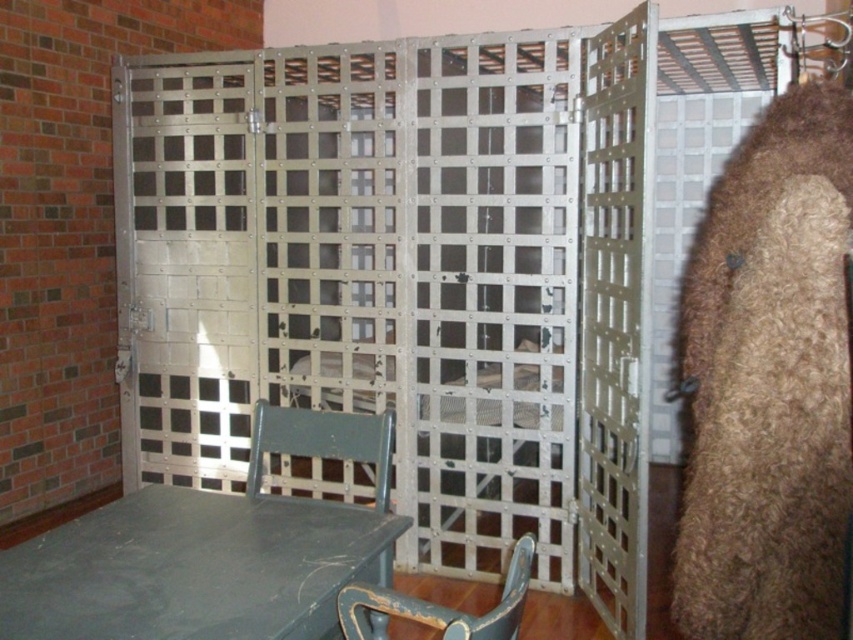
Is metallic grid cage at center closer to the viewer compared to matte green chair at center?

No.

Which of these two, metallic grid cage at center or matte green chair at center, stands taller?

Standing taller between the two is metallic grid cage at center.

This screenshot has height=640, width=853. Identify the location of metallic grid cage at center. (405, 280).

Image resolution: width=853 pixels, height=640 pixels. What are the coordinates of `metallic grid cage at center` in the screenshot? It's located at (405, 280).

Is brown fuzzy coat at right to the left of matte green chair at center from the viewer's perspective?

In fact, brown fuzzy coat at right is to the right of matte green chair at center.

Who is more distant from viewer, (747, 326) or (384, 579)?

The point (747, 326) is behind.

Who is more forward, (820, 339) or (386, 572)?

Point (820, 339)

At what (x,y) coordinates should I click in order to perform the action: click on brown fuzzy coat at right. Please return your answer as a coordinate pair (x, y). The image size is (853, 640). Looking at the image, I should click on (769, 381).

Who is higher up, matte green chair at center or chipped paint wood chair at lower center?

Positioned higher is matte green chair at center.

Which is more to the right, matte green chair at center or chipped paint wood chair at lower center?

From the viewer's perspective, chipped paint wood chair at lower center appears more on the right side.

The width and height of the screenshot is (853, 640). Describe the element at coordinates (323, 442) in the screenshot. I see `matte green chair at center` at that location.

At what (x,y) coordinates should I click in order to perform the action: click on matte green chair at center. Please return your answer as a coordinate pair (x, y). Looking at the image, I should click on (323, 442).